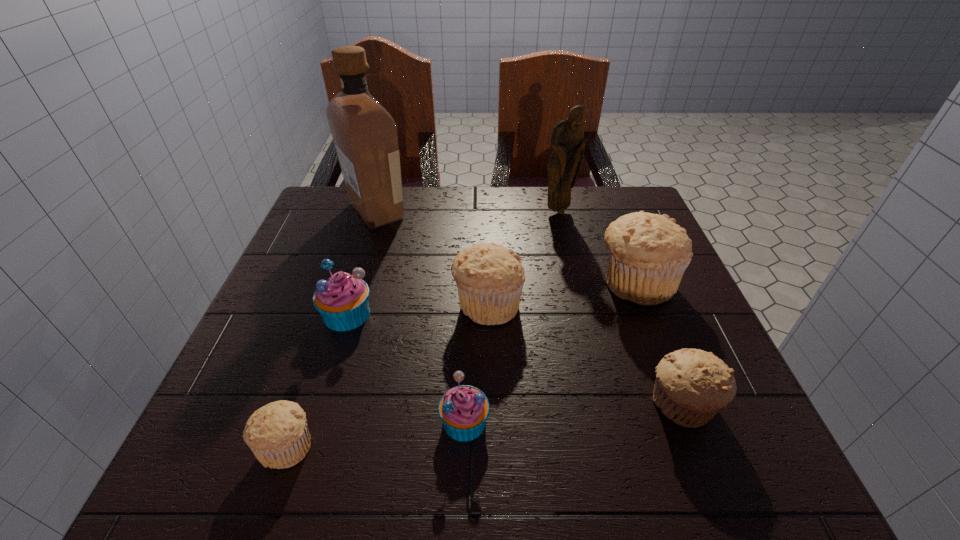
Locate an element on the screen. free spot located on the right of the smaller blue muffin is located at coordinates tap(591, 421).

What are the coordinates of `vacant position located 0.160m on the right of the smallest beige muffin` in the screenshot? It's located at 415,446.

This screenshot has width=960, height=540. Identify the location of liquor present at the far edge. (x=365, y=135).

Image resolution: width=960 pixels, height=540 pixels. I want to click on figurine that is at the far edge, so click(x=567, y=143).

Where is `liquor at the left edge`? liquor at the left edge is located at coordinates (365, 135).

The width and height of the screenshot is (960, 540). Identify the location of object located in the far left corner section of the desktop. (365, 135).

The height and width of the screenshot is (540, 960). What are the coordinates of `object that is at the near left corner` in the screenshot? It's located at (277, 433).

The height and width of the screenshot is (540, 960). What are the coordinates of `object that is at the near right corner` in the screenshot? It's located at (692, 385).

You are a GUI agent. You are given a task and a screenshot of the screen. Output one action in this format:
    pyautogui.click(x=<x>, y=<y>)
    Task: Click on the vacant space at the far edge of the desktop
    
    Given the screenshot: What is the action you would take?
    pyautogui.click(x=492, y=226)

In the image, there is a desktop. Identify the location of vacant space at the near edge. This screenshot has height=540, width=960. (561, 440).